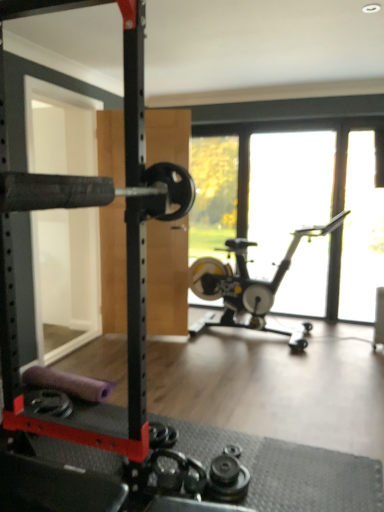
What do you see at coordinates (248, 284) in the screenshot? I see `silver metallic stationary bicycle at center` at bounding box center [248, 284].

This screenshot has width=384, height=512. Describe the element at coordinates (286, 192) in the screenshot. I see `transparent glass window at center` at that location.

The image size is (384, 512). In order to click on transparent glass window screen at right in this screenshot , I will do `click(361, 232)`.

Based on their sizes in the image, would you say silver metallic stationary bicycle at center is bigger or smaller than black rubber barbell at left?

silver metallic stationary bicycle at center is bigger than black rubber barbell at left.

Looking at this image, from the image's perspective, between silver metallic stationary bicycle at center and black rubber barbell at left, who is located below?

silver metallic stationary bicycle at center, from the image's perspective.

Is silver metallic stationary bicycle at center facing away from black rubber barbell at left?

No, silver metallic stationary bicycle at center's orientation is not away from black rubber barbell at left.

Can you confirm if silver metallic stationary bicycle at center is positioned to the right of black rubber barbell at left?

Indeed, silver metallic stationary bicycle at center is positioned on the right side of black rubber barbell at left.

Consider the image. How different are the orientations of black rubber barbell at left and transparent glass window screen at right in degrees?

89.8 degrees.

Would you say transparent glass window screen at right is part of black rubber barbell at left's contents?

That's incorrect, transparent glass window screen at right is not inside black rubber barbell at left.

Is black rubber barbell at left placed right next to transparent glass window screen at right?

There is a gap between black rubber barbell at left and transparent glass window screen at right.

From the picture: Is black rubber barbell at left turned away from transparent glass window screen at right?

No.

Is silver metallic stationary bicycle at center far away from transparent glass window at center?

Indeed, silver metallic stationary bicycle at center is not near transparent glass window at center.

Between silver metallic stationary bicycle at center and transparent glass window at center, which one has smaller size?

transparent glass window at center.

Is point (240, 323) closer or farther from the camera than point (253, 135)?

Point (240, 323) is positioned closer to the camera compared to point (253, 135).

From the image's perspective, is silver metallic stationary bicycle at center over transparent glass window at center?

No, from the image's perspective, silver metallic stationary bicycle at center is not over transparent glass window at center.

How different are the orientations of transparent glass window screen at right and silver metallic stationary bicycle at center in degrees?

7.92e-05 degrees separate the facing orientations of transparent glass window screen at right and silver metallic stationary bicycle at center.

Who is more distant, transparent glass window screen at right or silver metallic stationary bicycle at center?

transparent glass window screen at right is further from the camera.

Is transparent glass window screen at right facing away from silver metallic stationary bicycle at center?

No.

Choose the correct answer: Is transparent glass window screen at right inside silver metallic stationary bicycle at center or outside it?

transparent glass window screen at right is located beyond the bounds of silver metallic stationary bicycle at center.

From the picture: Could you tell me if silver metallic stationary bicycle at center is facing transparent glass window screen at right?

No, silver metallic stationary bicycle at center is not turned towards transparent glass window screen at right.

Considering the positions of objects silver metallic stationary bicycle at center and transparent glass window screen at right in the image provided, who is in front, silver metallic stationary bicycle at center or transparent glass window screen at right?

Positioned in front is silver metallic stationary bicycle at center.

From a real-world perspective, who is located lower, silver metallic stationary bicycle at center or transparent glass window screen at right?

silver metallic stationary bicycle at center, from a real-world perspective.

Can you confirm if silver metallic stationary bicycle at center is thinner than transparent glass window screen at right?

In fact, silver metallic stationary bicycle at center might be wider than transparent glass window screen at right.

From the image's perspective, is transparent glass window at center above or below black rubber barbell at left?

Clearly, from the image's perspective, transparent glass window at center is above black rubber barbell at left.

Considering the relative sizes of transparent glass window at center and black rubber barbell at left in the image provided, is transparent glass window at center smaller than black rubber barbell at left?

Yes, transparent glass window at center is smaller than black rubber barbell at left.

Can you confirm if transparent glass window at center is positioned to the left of black rubber barbell at left?

Incorrect, transparent glass window at center is not on the left side of black rubber barbell at left.

From the image's perspective, between black rubber barbell at left and transparent glass window at center, who is located below?

black rubber barbell at left, from the image's perspective.

Is black rubber barbell at left in front of or behind transparent glass window at center in the image?

black rubber barbell at left is positioned closer to the viewer than transparent glass window at center.

From a real-world perspective, which object rests below the other?

transparent glass window at center.

Identify the location of stationary bicycle located underneath the black rubber barbell at left (from a real-world perspective). The width and height of the screenshot is (384, 512). (248, 284).

At what (x,y) coordinates should I click in order to perform the action: click on screen door in front of the transparent glass window screen at right. Please return your answer as a coordinate pair (x, y). Looking at the image, I should click on (65, 280).

Based on their spatial positions, is transparent glass window screen at right or black rubber barbell at left further from silver metallic stationary bicycle at center?

Among the two, black rubber barbell at left is located further to silver metallic stationary bicycle at center.

Based on their spatial positions, is silver metallic stationary bicycle at center or transparent glass window at center further from transparent glass window screen at right?

transparent glass window at center lies further to transparent glass window screen at right than the other object.

When comparing their distances from silver metallic stationary bicycle at center, does black rubber barbell at left or transparent glass window at center seem further?

Among the two, black rubber barbell at left is located further to silver metallic stationary bicycle at center.

Which object lies further to the anchor point black rubber barbell at left, transparent glass window at center or silver metallic stationary bicycle at center?

transparent glass window at center lies further to black rubber barbell at left than the other object.

Estimate the real-world distances between objects in this image. Which object is closer to transparent glass window at center, silver metallic stationary bicycle at center or black rubber barbell at left?

Among the two, silver metallic stationary bicycle at center is located nearer to transparent glass window at center.

Estimate the real-world distances between objects in this image. Which object is further from transparent glass window at center, silver metallic stationary bicycle at center or transparent glass window screen at right?

silver metallic stationary bicycle at center is further to transparent glass window at center.

Which object lies further to the anchor point black rubber barbell at left, transparent glass window at center or transparent glass window screen at right?

The object further to black rubber barbell at left is transparent glass window screen at right.

Based on their spatial positions, is silver metallic stationary bicycle at center or transparent glass window screen at right closer to black rubber barbell at left?

Among the two, silver metallic stationary bicycle at center is located nearer to black rubber barbell at left.

Find the location of `window screen between silver metallic stationary bicycle at center and transparent glass window at center in the front-back direction`. window screen between silver metallic stationary bicycle at center and transparent glass window at center in the front-back direction is located at coordinates pos(361,232).

Find the location of a particular element. This screenshot has width=384, height=512. window between black rubber barbell at left and transparent glass window screen at right in the horizontal direction is located at coordinates (286, 192).

The width and height of the screenshot is (384, 512). What are the coordinates of `stationary bicycle situated between black rubber barbell at left and transparent glass window screen at right from left to right` in the screenshot? It's located at [248, 284].

Identify the location of stationary bicycle between black rubber barbell at left and transparent glass window at center in the horizontal direction. The image size is (384, 512). (248, 284).